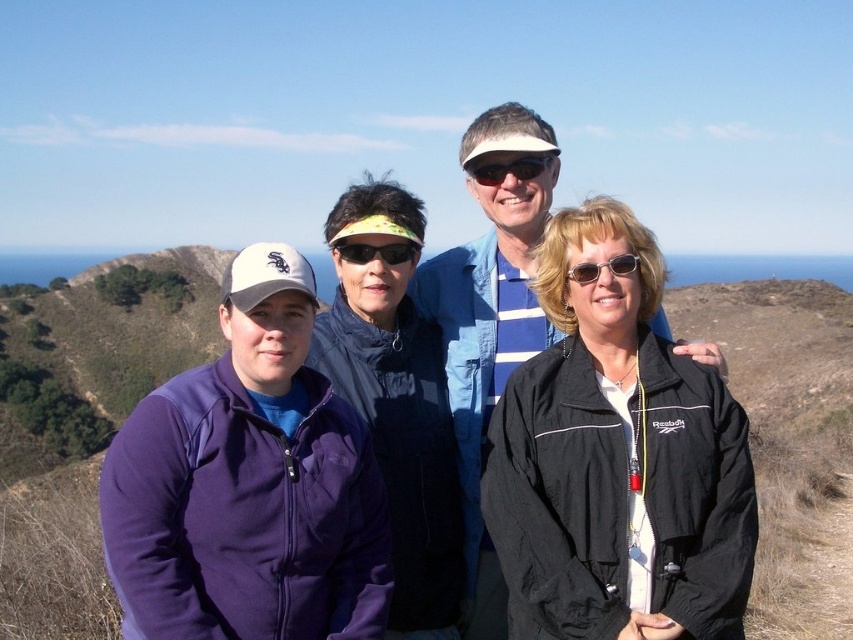
You are a photographer trying to capture a group photo of the four people on the hilltop. You notice that the blue striped shirt at center and the sunglasses at center are overlapping in the current composition. To avoid this overlap, should you adjust the camera angle to look upwards or downwards?

The blue striped shirt at center is located above the sunglasses at center. To avoid overlapping, you should adjust the camera angle to look downwards so that the blue striped shirt at center moves out of the frame or shifts position relative to the sunglasses at center.